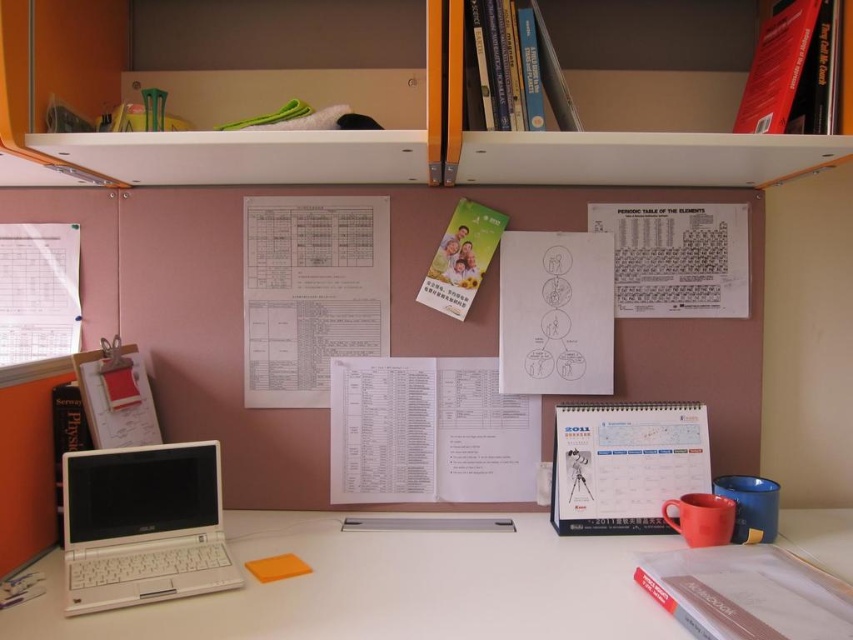
Consider the image. You are standing at the desk and want to reach both the white plastic laptop at lower left and the white plastic shelf at upper center. Which object will you need to stretch your arm more to reach?

You will need to stretch your arm more to reach the white plastic shelf at upper center because it is further away from you compared to the white plastic laptop at lower left.

You are a delivery robot with a height of 30 inches. You need to deliver a package to the white plastic shelf at upper center. The path to the shelf is clear except for the white plastic laptop at lower left. Can you pass by the laptop without hitting your head?

The white plastic laptop at lower left and white plastic shelf at upper center are 31.55 inches apart from each other. Since the robot is 30 inches tall, there is enough space between them for the robot to pass without hitting its head.

You are a delivery person who needs to place a new camera on the desk without moving any existing items. The camera requires 12 inches of space to fit. Is there enough space between the white plastic bookshelf at upper center and the nearest object on the desk?

The white plastic bookshelf at upper center and camera are 37.67 inches apart from each other, so there is more than enough space to place the camera between the white plastic bookshelf at upper center and the nearest object on the desk since 37.67 inches is greater than the required 12 inches.